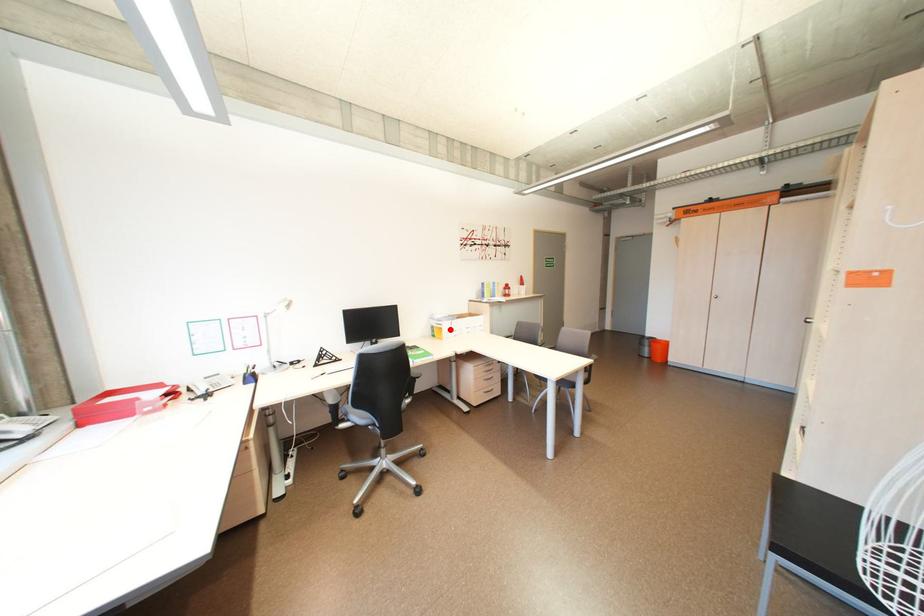
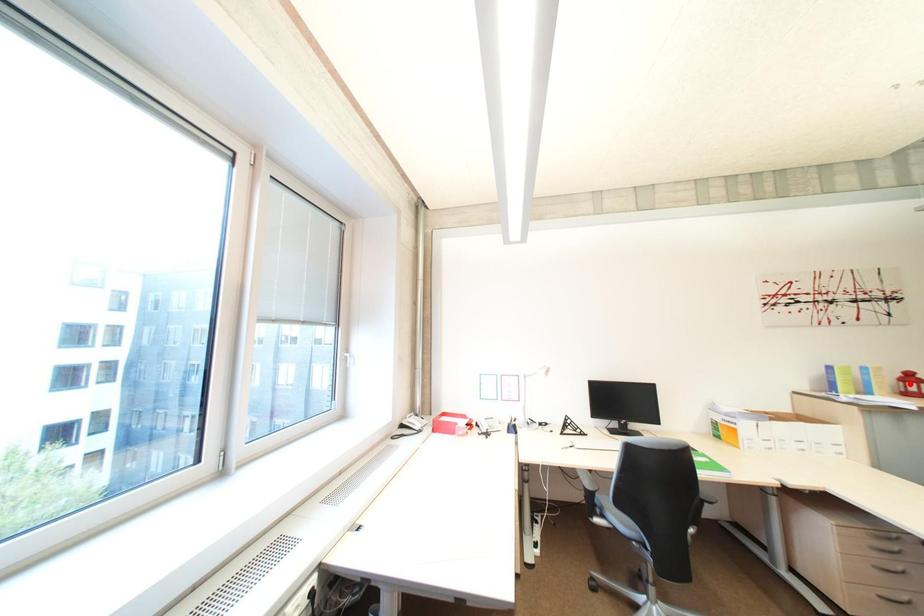
I am providing you with two images of the same scene from different viewpoints. A red point is marked on the first image and another point is marked on the second image. Are the points marked in image1 and image2 representing the same 3D position?

No